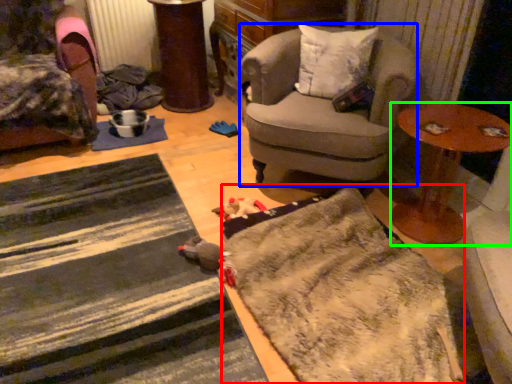
Question: Which object is positioned farthest from doormat (highlighted by a red box)? Select from chair (highlighted by a blue box) and table (highlighted by a green box).

Choices:
 (A) chair
 (B) table

Answer: (A)